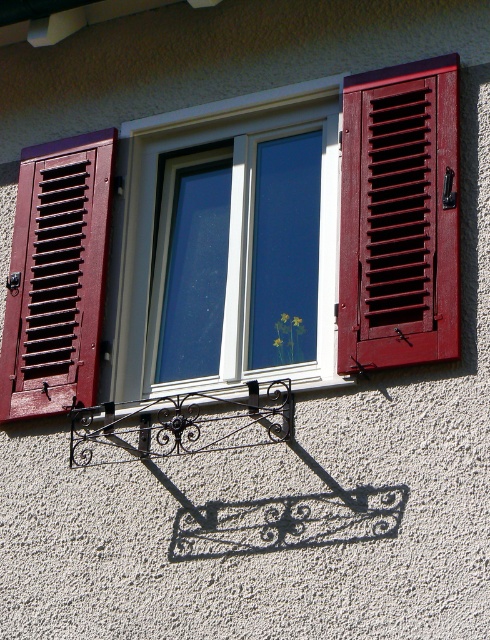
Is matte glass window at center above matte wood shutter at right?

Incorrect, matte glass window at center is not positioned above matte wood shutter at right.

Does matte glass window at center appear under matte wood shutter at right?

Yes, matte glass window at center is below matte wood shutter at right.

Who is more distant from viewer, (259, 308) or (397, 257)?

The point (259, 308) is behind.

Locate an element on the screen. Image resolution: width=490 pixels, height=640 pixels. matte glass window at center is located at coordinates (245, 259).

Looking at this image, does matte wood shutter at right have a greater width compared to matte wood shutter at left?

Yes.

Which is in front, point (360, 166) or point (40, 364)?

Point (360, 166)

Identify the location of matte wood shutter at right. Image resolution: width=490 pixels, height=640 pixels. (399, 216).

In the scene shown: Does matte white window frame at center have a lesser height compared to matte wood shutter at left?

In fact, matte white window frame at center may be taller than matte wood shutter at left.

At what (x,y) coordinates should I click in order to perform the action: click on matte white window frame at center. Please return your answer as a coordinate pair (x, y). This screenshot has height=640, width=490. Looking at the image, I should click on (292, 236).